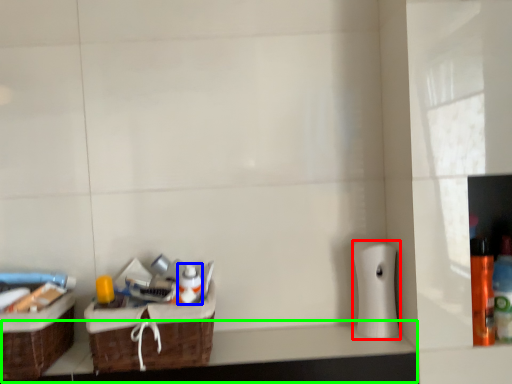
Question: Considering the real-world distances, which object is closest to toilet paper (highlighted by a red box)? mouthwash (highlighted by a blue box) or counter top (highlighted by a green box).

Choices:
 (A) mouthwash
 (B) counter top

Answer: (B)